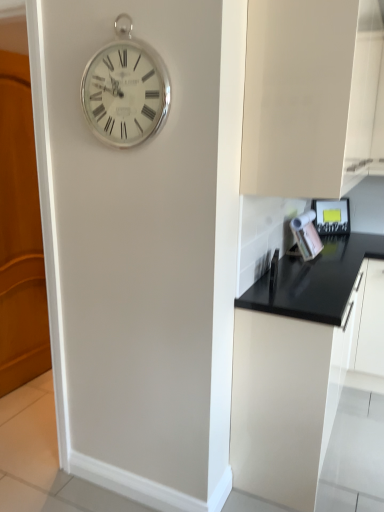
Question: Relative to wooden at left, is silver metallic clock at upper center in front or behind?

Choices:
 (A) behind
 (B) front

Answer: (B)

Question: Is silver metallic clock at upper center to the left or to the right of wooden at left in the image?

Choices:
 (A) left
 (B) right

Answer: (B)

Question: Based on their relative distances, which object is farther from the matte white cabinet at upper right, marked as the 1th cabinetry in a top-to-bottom arrangement?

Choices:
 (A) black matte cabinet at lower right, placed as the first cabinetry when sorted from bottom to top
 (B) silver metallic clock at upper center
 (C) wooden at left
 (D) metallic silver toaster at right

Answer: (C)

Question: Which of these objects is positioned farthest from the black matte cabinet at lower right, placed as the first cabinetry when sorted from bottom to top?

Choices:
 (A) matte white cabinet at upper right, which appears as the 2th cabinetry when ordered from the bottom
 (B) wooden at left
 (C) metallic silver toaster at right
 (D) silver metallic clock at upper center

Answer: (B)